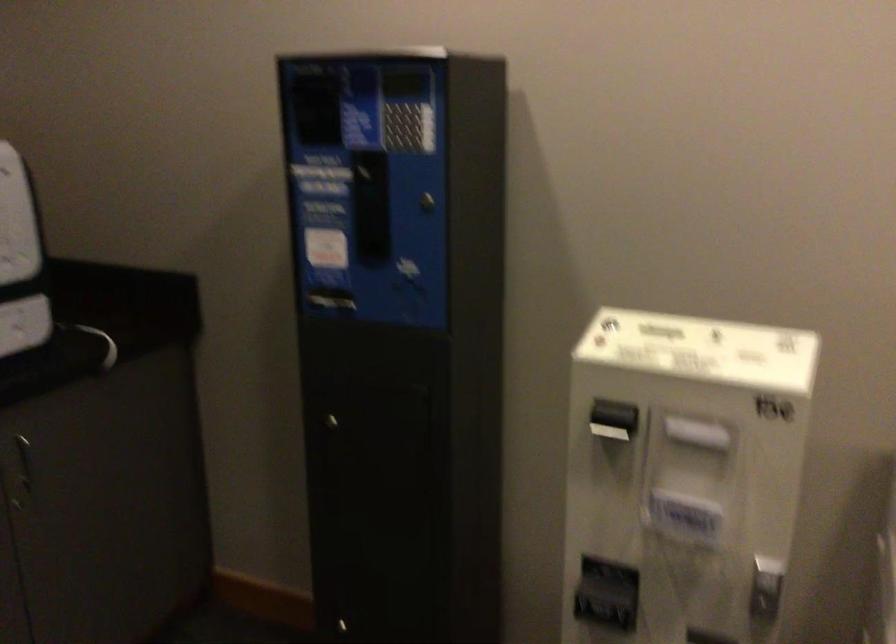
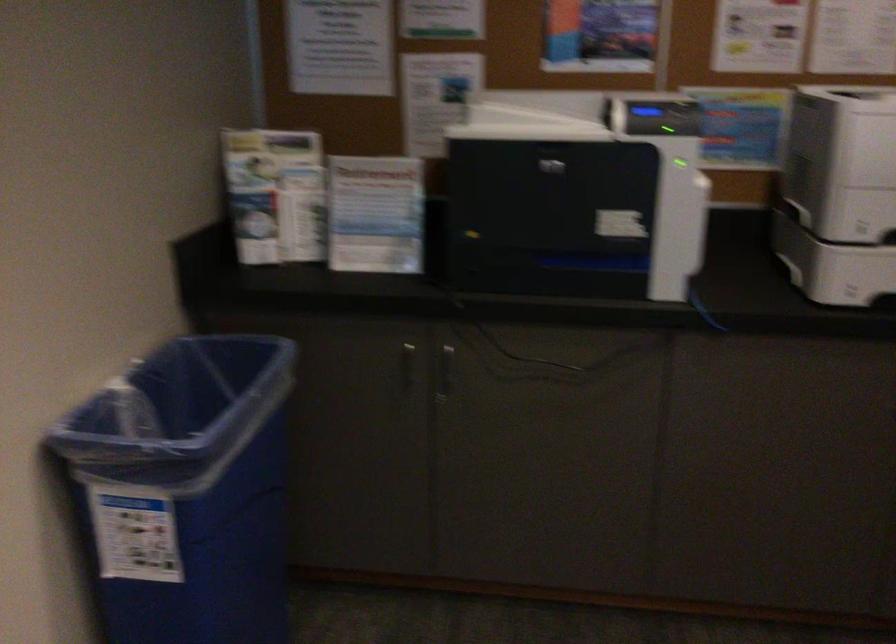
Question: Based on the continuous images, in which direction is the camera rotating? Reply with the corresponding letter.

Choices:
 (A) Left
 (B) Right
 (C) Up
 (D) Down

Answer: (A)